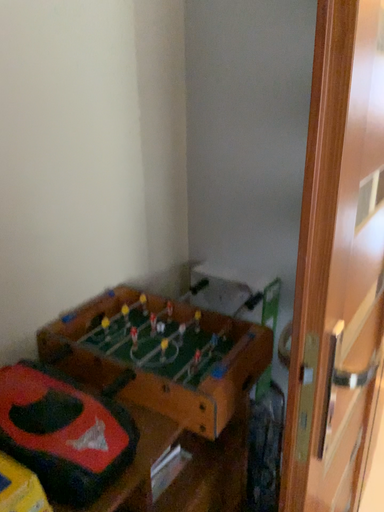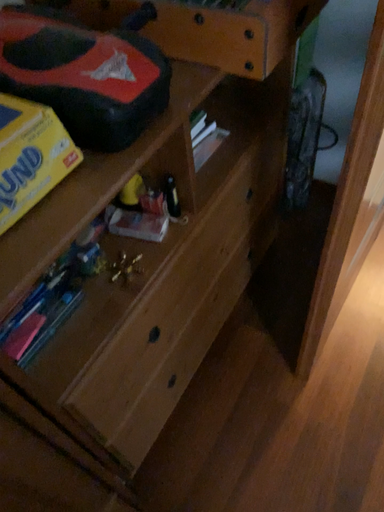
Question: How did the camera likely rotate when shooting the video?

Choices:
 (A) rotated upward
 (B) rotated downward

Answer: (B)